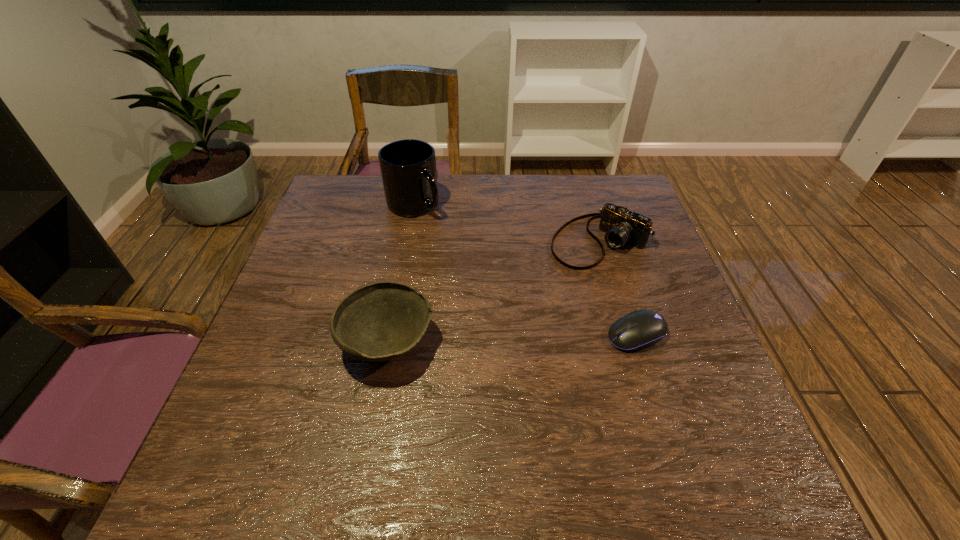
Locate an element on the screen. This screenshot has width=960, height=540. vacant area that lies between the tallest object and the camera is located at coordinates (507, 223).

The width and height of the screenshot is (960, 540). Identify the location of free space that is in between the bowl and the camera. (494, 292).

Image resolution: width=960 pixels, height=540 pixels. I want to click on object that ranks as the third closest to the third tallest object, so click(381, 321).

Identify which object is the nearest to the bowl. Please provide its 2D coordinates. Your answer should be formatted as a tuple, i.e. [(x, y)], where the tuple contains the x and y coordinates of a point satisfying the conditions above.

[(621, 226)]

At what (x,y) coordinates should I click in order to perform the action: click on free space that satisfies the following two spatial constraints: 1. on the back side of the second tallest object; 2. on the left side of the camera. Please return your answer as a coordinate pair (x, y). Looking at the image, I should click on (407, 241).

This screenshot has height=540, width=960. What are the coordinates of `vacant area that satisfies the following two spatial constraints: 1. on the back side of the third shortest object; 2. on the left side of the camera` in the screenshot? It's located at (407, 241).

The width and height of the screenshot is (960, 540). I want to click on vacant space that satisfies the following two spatial constraints: 1. on the front side of the shortest object; 2. on the left side of the second shortest object, so click(x=630, y=334).